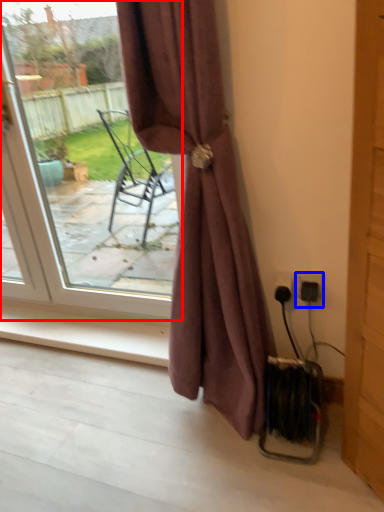
Question: Which point is closer to the camera, door (highlighted by a red box) or electric outlet (highlighted by a blue box)?

Choices:
 (A) door
 (B) electric outlet

Answer: (A)